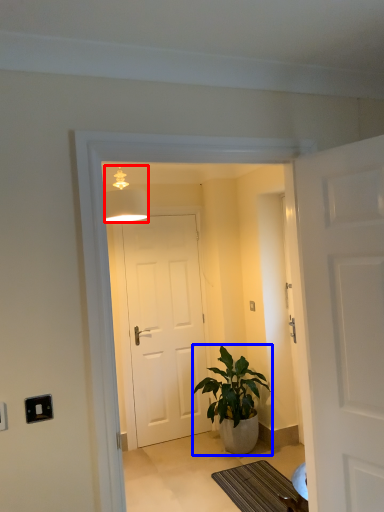
Question: Which object is further to the camera taking this photo, lamp (highlighted by a red box) or houseplant (highlighted by a blue box)?

Choices:
 (A) lamp
 (B) houseplant

Answer: (B)